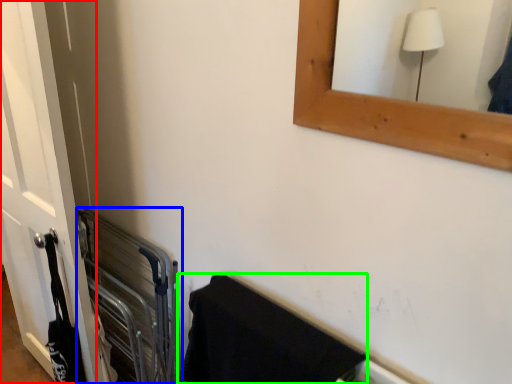
Question: Estimate the real-world distances between objects in this image. Which object is farther from door (highlighted by a red box), balustrade (highlighted by a blue box) or bath towel (highlighted by a green box)?

Choices:
 (A) balustrade
 (B) bath towel

Answer: (B)